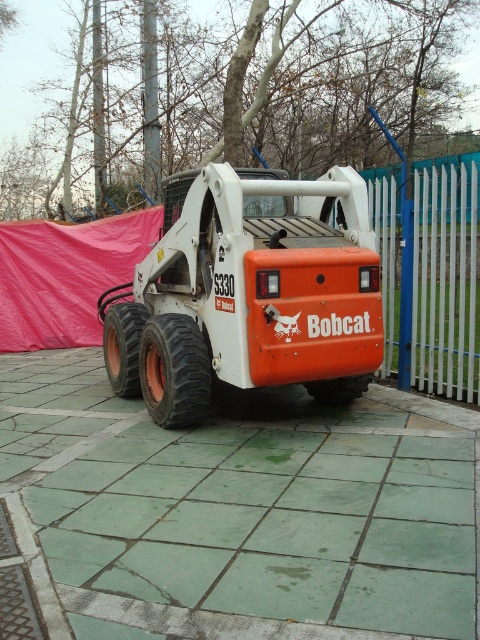
You are standing at the point (264,176) and want to walk to the Bobcat S330 loader. The loader is 6.59 meters away from you. If you walk straight towards it, will you pass through the white picket fence on the right side of the frame?

The Bobcat S330 loader is 6.59 meters away from the point (264,176). Since the white picket fence runs parallel to the right side of the frame and the loader is parked on the paved area, walking straight towards the loader would not require passing through the fence as it is positioned to the side of the path.

You are standing in front of a Bobcat S330 loader on a paved area. There is a point marked at coordinates (278, 490). If you want to place a 5 meter long safety barrier between you and this point, will it fit without extending beyond the point?

The distance between you and the point is 4.31 meters. Since the safety barrier is 5 meters long, it will extend 0.69 meters beyond the point.

You are a construction worker planning to move the orange matte bobcat at center closer to the white metal fence at right. Based on their current positions, which direction should you move the bobcat to get it closer to the fence?

The orange matte bobcat at center is located below the white metal fence at right. To move it closer, you should move it upward towards the white metal fence at right.